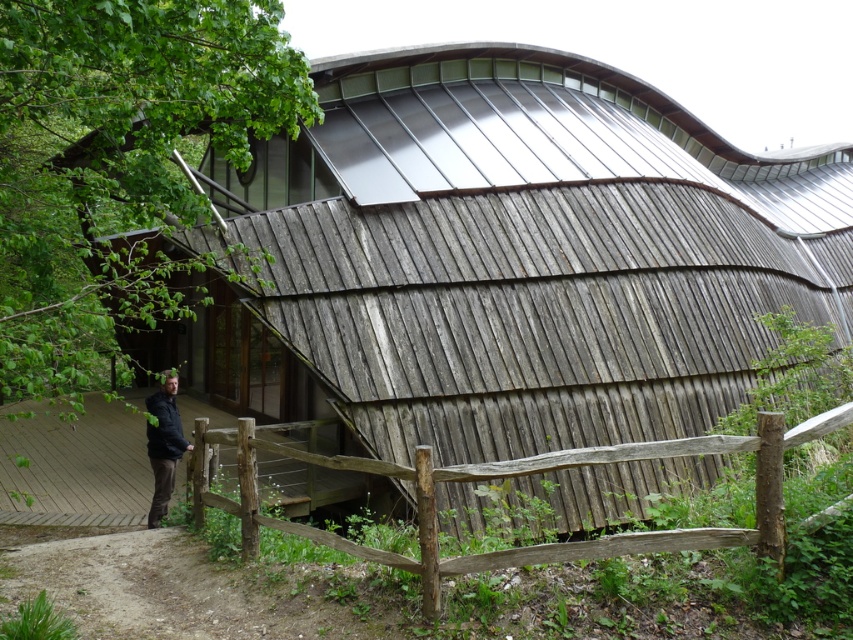
Question: Which point is farther to the camera?

Choices:
 (A) (148, 404)
 (B) (573, 547)

Answer: (A)

Question: Which of the following is the farthest from the observer?

Choices:
 (A) (706, 545)
 (B) (175, 419)

Answer: (B)

Question: Does weathered wood fence at lower center have a smaller size compared to dark gray hoodie at center?

Choices:
 (A) yes
 (B) no

Answer: (B)

Question: Is weathered wood fence at lower center smaller than dark gray hoodie at center?

Choices:
 (A) no
 (B) yes

Answer: (A)

Question: Is weathered wood fence at lower center thinner than dark gray hoodie at center?

Choices:
 (A) no
 (B) yes

Answer: (A)